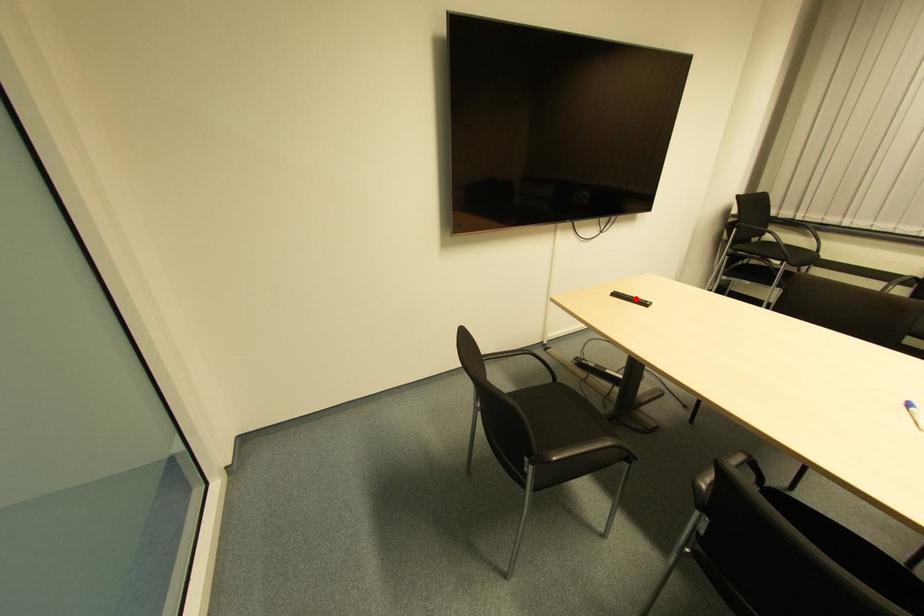
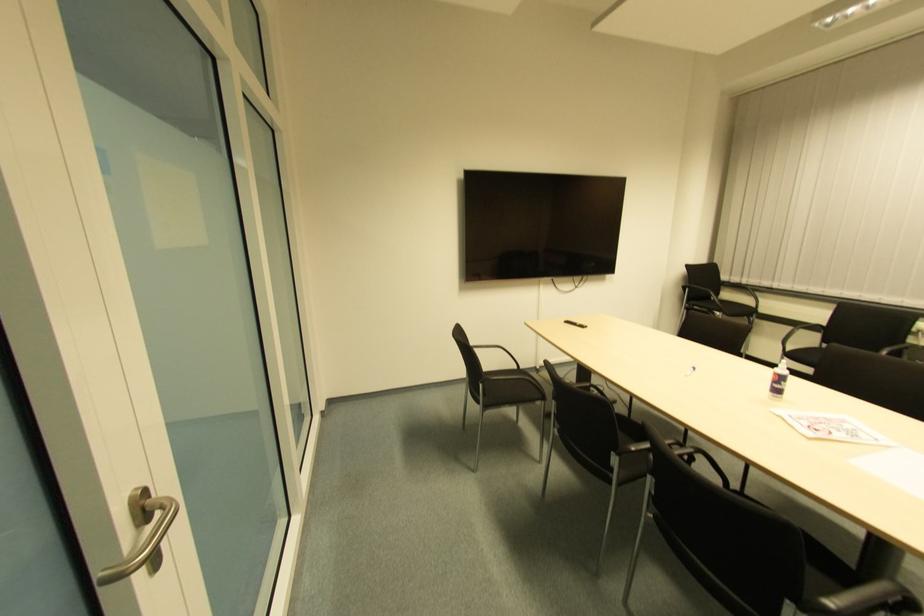
Locate, in the second image, the point that corresponds to the highlighted location in the first image.

(577, 325)